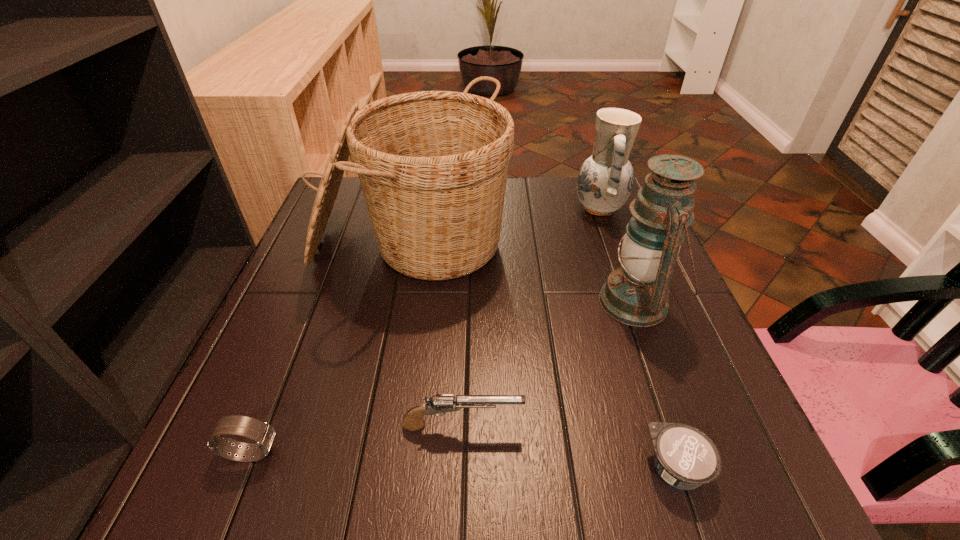
At what (x,y) coordinates should I click in order to perform the action: click on free region located 0.100m on either side of the pottery. Please return your answer as a coordinate pair (x, y). Looking at the image, I should click on (538, 208).

Locate an element on the screen. Image resolution: width=960 pixels, height=540 pixels. vacant position located 0.330m on the face of the watch is located at coordinates (485, 453).

Image resolution: width=960 pixels, height=540 pixels. I want to click on vacant space positioned aiming along the barrel of the third nearest object, so click(x=688, y=426).

Where is `vacant space situated on the back of the yogurt`? The width and height of the screenshot is (960, 540). vacant space situated on the back of the yogurt is located at coordinates (636, 348).

At what (x,y) coordinates should I click in order to perform the action: click on basket positioned at the far edge. Please return your answer as a coordinate pair (x, y). This screenshot has width=960, height=540. Looking at the image, I should click on (433, 165).

Locate an element on the screen. pottery that is positioned at the far edge is located at coordinates (605, 180).

Locate an element on the screen. watch at the near edge is located at coordinates (263, 434).

You are a GUI agent. You are given a task and a screenshot of the screen. Output one action in this format:
    pyautogui.click(x=<x>, y=<y>)
    Task: Click on the yogurt at the near edge
    This screenshot has height=540, width=960.
    Given the screenshot: What is the action you would take?
    pyautogui.click(x=685, y=457)

Locate an element on the screen. This screenshot has height=540, width=960. basket located in the left edge section of the desktop is located at coordinates (433, 165).

The image size is (960, 540). What are the coordinates of `watch located at the left edge` in the screenshot? It's located at (263, 434).